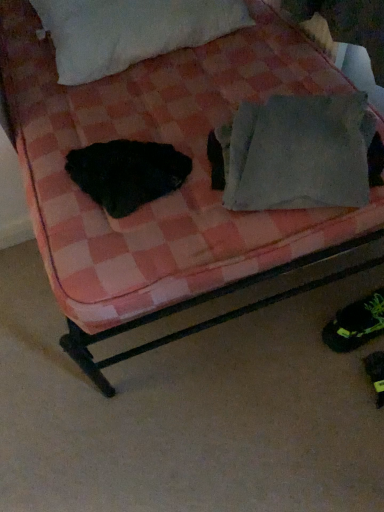
Find the location of a particular element. The width and height of the screenshot is (384, 512). free space to the left of green synthetic shoe at lower right is located at coordinates (288, 332).